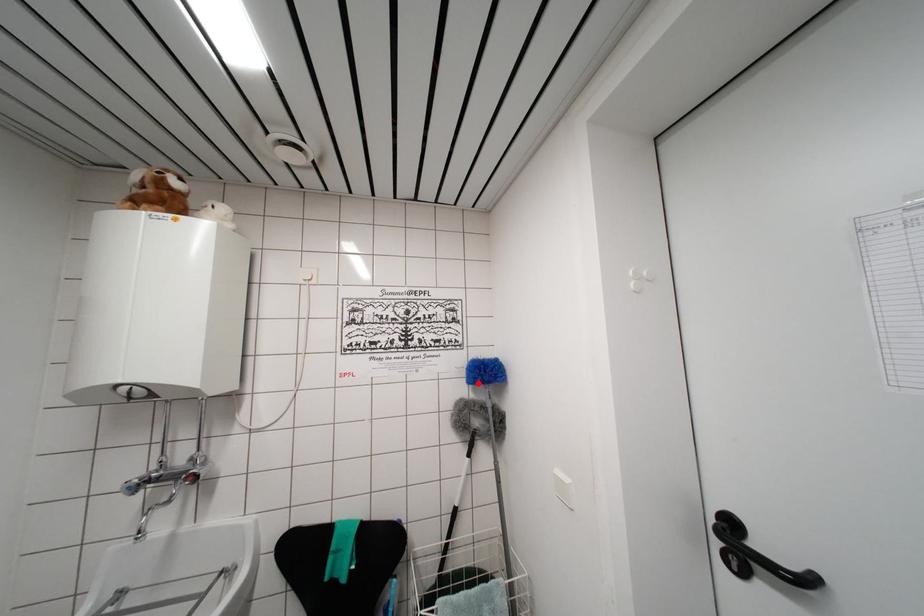
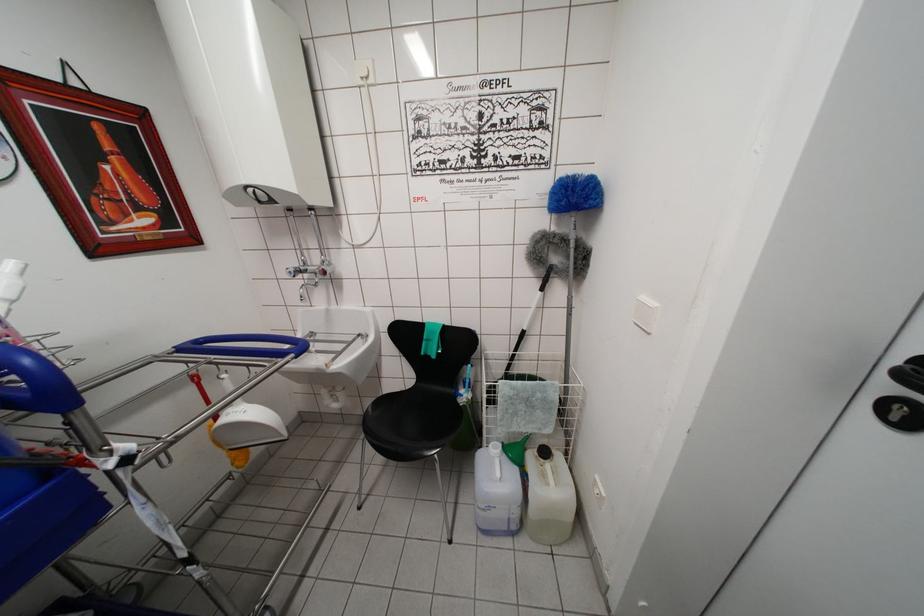
Question: I am providing you with two images of the same scene from different viewpoints. In image1, a red point is highlighted. Considering the same 3D point in image2, which of the following is correct?

Choices:
 (A) It is closer
 (B) It is farther

Answer: (A)